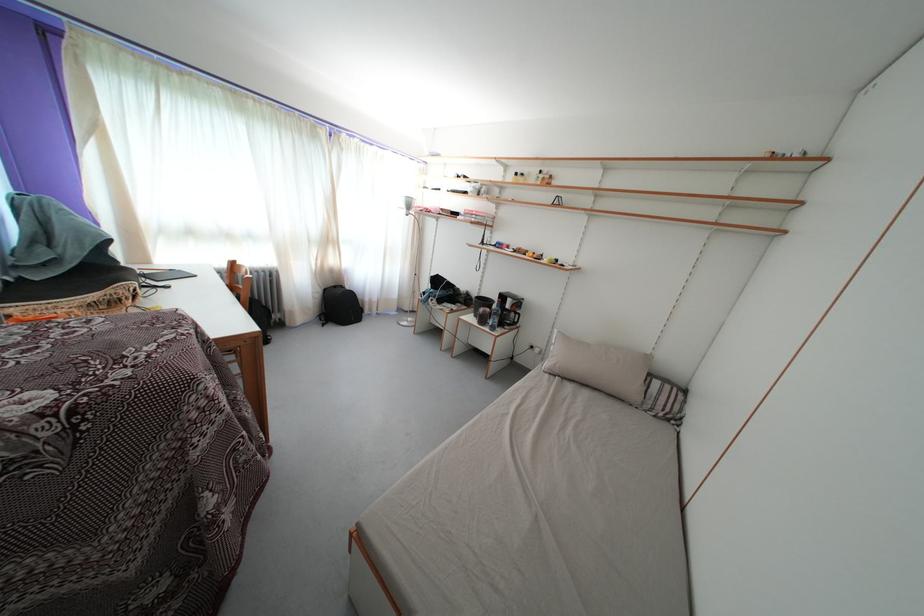
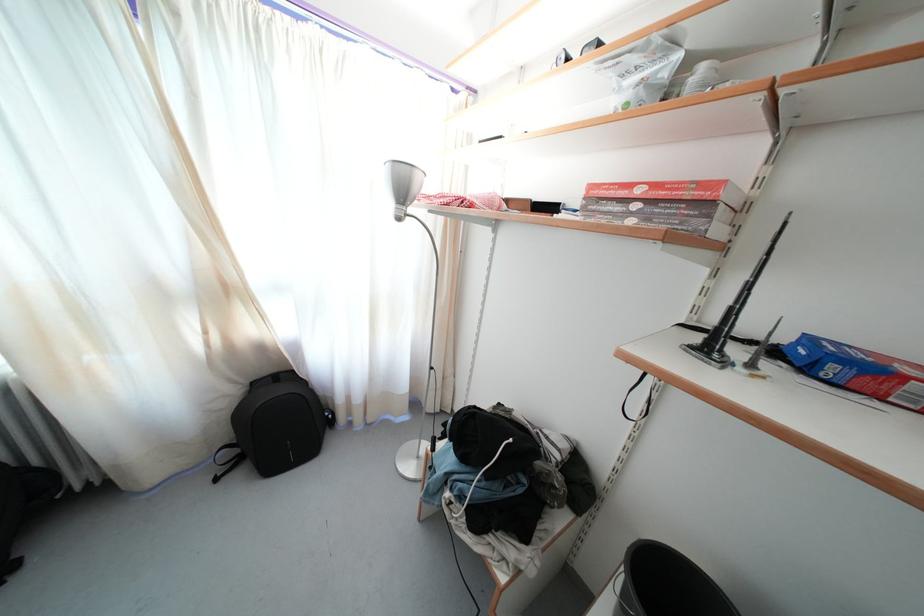
Find the pixel in the second image that matches the point at 332,296 in the first image.

(259, 390)